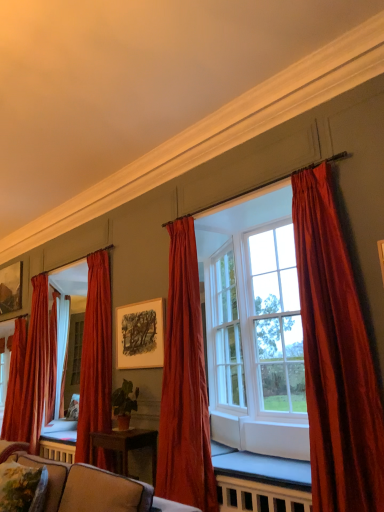
Question: Considering the relative positions of velvet red curtain at left, which appears as the 1th curtain when viewed from the left, and velvet red curtain at right, which is counted as the fifth curtain, starting from the back, in the image provided, is velvet red curtain at left, which appears as the 1th curtain when viewed from the left, to the right of velvet red curtain at right, which is counted as the fifth curtain, starting from the back, from the viewer's perspective?

Choices:
 (A) yes
 (B) no

Answer: (B)

Question: Considering the relative sizes of velvet red curtain at left, which appears as the 1th curtain when viewed from the left, and velvet red curtain at right, which is counted as the fifth curtain, starting from the back, in the image provided, is velvet red curtain at left, which appears as the 1th curtain when viewed from the left, taller than velvet red curtain at right, which is counted as the fifth curtain, starting from the back,?

Choices:
 (A) yes
 (B) no

Answer: (B)

Question: Is velvet red curtain at left, positioned as the 1th curtain in back-to-front order, aimed at velvet red curtain at right, which ranks as the first curtain in right-to-left order?

Choices:
 (A) yes
 (B) no

Answer: (B)

Question: Does velvet red curtain at left, positioned as the 1th curtain in back-to-front order, have a greater width compared to velvet red curtain at right, which is counted as the fifth curtain, starting from the back?

Choices:
 (A) no
 (B) yes

Answer: (A)

Question: Is velvet red curtain at left, which appears as the 5th curtain when viewed from the right, not within velvet red curtain at right, which ranks as the first curtain in right-to-left order?

Choices:
 (A) no
 (B) yes

Answer: (B)

Question: Is matte black picture frame at upper left, acting as the 2th picture frame starting from the right, wider or thinner than velvet floral pillow at lower left?

Choices:
 (A) thin
 (B) wide

Answer: (A)

Question: Is matte black picture frame at upper left, which appears as the 1th picture frame when viewed from the back, inside the boundaries of velvet floral pillow at lower left, or outside?

Choices:
 (A) outside
 (B) inside

Answer: (A)

Question: From their relative heights in the image, would you say matte black picture frame at upper left, acting as the 2th picture frame starting from the right, is taller or shorter than velvet floral pillow at lower left?

Choices:
 (A) short
 (B) tall

Answer: (B)

Question: Is matte black picture frame at upper left, which appears as the 1th picture frame when viewed from the back, to the left or to the right of velvet floral pillow at lower left in the image?

Choices:
 (A) right
 (B) left

Answer: (B)

Question: From their relative heights in the image, would you say velvet beige couch at lower center is taller or shorter than velvet red curtain at right, marked as the 5th curtain in a left-to-right arrangement?

Choices:
 (A) short
 (B) tall

Answer: (A)

Question: Would you say velvet beige couch at lower center is to the left or to the right of velvet red curtain at right, marked as the 5th curtain in a left-to-right arrangement, in the picture?

Choices:
 (A) left
 (B) right

Answer: (A)

Question: Considering the positions of velvet beige couch at lower center and velvet red curtain at right, which appears as the 1th curtain when viewed from the front, in the image, is velvet beige couch at lower center bigger or smaller than velvet red curtain at right, which appears as the 1th curtain when viewed from the front,?

Choices:
 (A) big
 (B) small

Answer: (A)

Question: From a real-world perspective, is velvet beige couch at lower center physically located above or below velvet red curtain at right, marked as the 5th curtain in a left-to-right arrangement?

Choices:
 (A) above
 (B) below

Answer: (B)

Question: Looking at the image, does velvet floral pillow at lower left seem bigger or smaller compared to velvet red curtain at left, which appears as the 1th curtain when viewed from the left?

Choices:
 (A) big
 (B) small

Answer: (B)

Question: In terms of height, does velvet floral pillow at lower left look taller or shorter compared to velvet red curtain at left, positioned as the 1th curtain in back-to-front order?

Choices:
 (A) short
 (B) tall

Answer: (A)